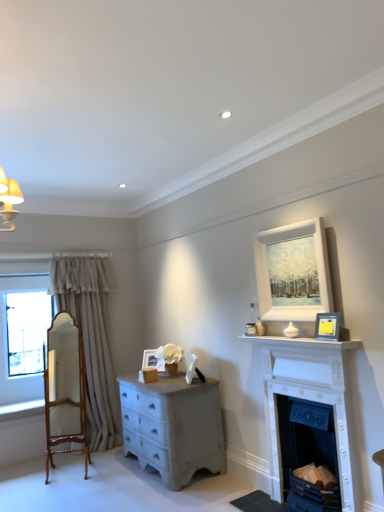
Question: Does matte white picture frame at center, which is the first picture frame from back to front, lie in front of white painted wood fireplace at right, which is the 2th fireplace in bottom-to-top order?

Choices:
 (A) no
 (B) yes

Answer: (A)

Question: From a real-world perspective, does matte white picture frame at center, which is the first picture frame from back to front, sit lower than white painted wood fireplace at right, which is the 2th fireplace in bottom-to-top order?

Choices:
 (A) yes
 (B) no

Answer: (B)

Question: Does matte white picture frame at center, marked as the 1th picture frame in a left-to-right arrangement, lie behind white painted wood fireplace at right, which is the 2th fireplace in bottom-to-top order?

Choices:
 (A) yes
 (B) no

Answer: (A)

Question: Does matte white picture frame at center, the fourth picture frame in the front-to-back sequence, have a lesser width compared to white painted wood fireplace at right, which is the 1th fireplace from top to bottom?

Choices:
 (A) no
 (B) yes

Answer: (B)

Question: Is matte white picture frame at center, which is the first picture frame from back to front, turned away from white painted wood fireplace at right, which is the 1th fireplace from top to bottom?

Choices:
 (A) yes
 (B) no

Answer: (B)

Question: In terms of width, does black matte picture frame at upper right, which is counted as the third picture frame, starting from the bottom, look wider or thinner when compared to white painted wood mantle at upper center?

Choices:
 (A) wide
 (B) thin

Answer: (B)

Question: Is point (319, 324) closer or farther from the camera than point (339, 345)?

Choices:
 (A) closer
 (B) farther

Answer: (B)

Question: Looking at the image, does black matte picture frame at upper right, the 1th picture frame from the right, seem bigger or smaller compared to white painted wood mantle at upper center?

Choices:
 (A) big
 (B) small

Answer: (B)

Question: In terms of height, does black matte picture frame at upper right, the 4th picture frame in the back-to-front sequence, look taller or shorter compared to white painted wood mantle at upper center?

Choices:
 (A) tall
 (B) short

Answer: (A)

Question: Is white painted wood fireplace at right, which is the 1th fireplace from top to bottom, to the left or to the right of white painted wood fireplace at lower right, which ranks as the second fireplace in top-to-bottom order, in the image?

Choices:
 (A) left
 (B) right

Answer: (A)

Question: Does point (274, 481) appear closer or farther from the camera than point (309, 428)?

Choices:
 (A) farther
 (B) closer

Answer: (A)

Question: Is white painted wood fireplace at right, which is the 2th fireplace in bottom-to-top order, taller or shorter than white painted wood fireplace at lower right, which ranks as the second fireplace in top-to-bottom order?

Choices:
 (A) tall
 (B) short

Answer: (A)

Question: Is white painted wood fireplace at right, which is the 1th fireplace from top to bottom, inside the boundaries of white painted wood fireplace at lower right, the first fireplace ordered from the bottom, or outside?

Choices:
 (A) outside
 (B) inside

Answer: (B)

Question: Is white painted wood fireplace at lower right, which ranks as the second fireplace in top-to-bottom order, in front of or behind wooden polished mirror at left in the image?

Choices:
 (A) behind
 (B) front

Answer: (B)

Question: Looking at the image, does white painted wood fireplace at lower right, the first fireplace ordered from the bottom, seem bigger or smaller compared to wooden polished mirror at left?

Choices:
 (A) big
 (B) small

Answer: (B)